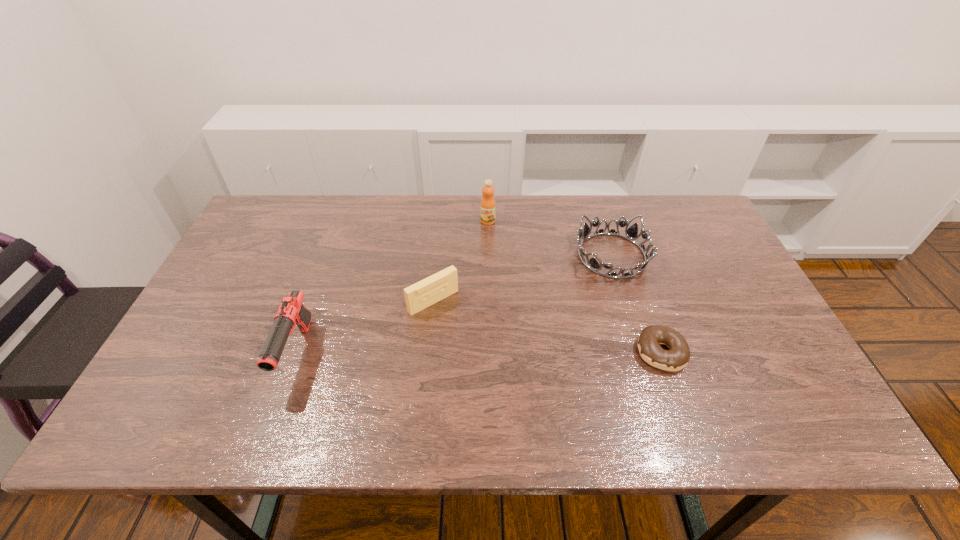
The image size is (960, 540). I want to click on free space in the image that satisfies the following two spatial constraints: 1. on the back side of the videotape; 2. on the right side of the tiara, so click(438, 255).

You are a GUI agent. You are given a task and a screenshot of the screen. Output one action in this format:
    pyautogui.click(x=<x>, y=<y>)
    Task: Click on the free point that satisfies the following two spatial constraints: 1. on the front side of the orange juice; 2. on the right side of the tiara
    This screenshot has height=540, width=960.
    Given the screenshot: What is the action you would take?
    pyautogui.click(x=489, y=255)